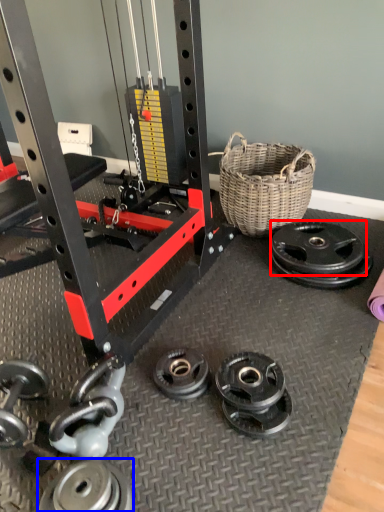
Question: Which object appears farthest to the camera in this image, wheel (highlighted by a red box) or wheel (highlighted by a blue box)?

Choices:
 (A) wheel
 (B) wheel

Answer: (A)